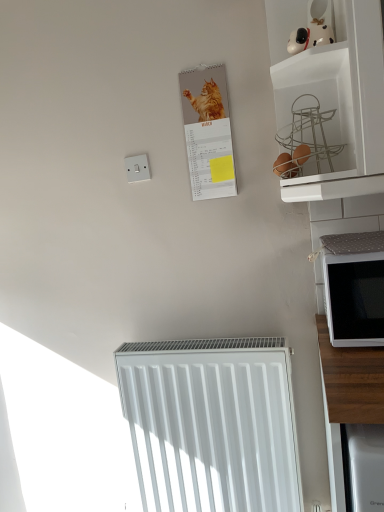
Question: Can you confirm if white matte microwave at right is shorter than white matte wire basket at upper right?

Choices:
 (A) no
 (B) yes

Answer: (B)

Question: Considering the relative sizes of white matte microwave at right and white matte wire basket at upper right in the image provided, is white matte microwave at right bigger than white matte wire basket at upper right?

Choices:
 (A) no
 (B) yes

Answer: (A)

Question: From a real-world perspective, does white matte microwave at right stand above white matte wire basket at upper right?

Choices:
 (A) yes
 (B) no

Answer: (B)

Question: Is white matte microwave at right in contact with white matte wire basket at upper right?

Choices:
 (A) no
 (B) yes

Answer: (A)

Question: Is white matte microwave at right to the left of white matte wire basket at upper right from the viewer's perspective?

Choices:
 (A) no
 (B) yes

Answer: (A)

Question: From the image's perspective, is white matte microwave at right above white matte wire basket at upper right?

Choices:
 (A) yes
 (B) no

Answer: (B)

Question: Does matte paper calendar at upper center have a greater height compared to white plastic switch at upper left?

Choices:
 (A) yes
 (B) no

Answer: (A)

Question: Does matte paper calendar at upper center turn towards white plastic switch at upper left?

Choices:
 (A) no
 (B) yes

Answer: (A)

Question: Can you confirm if matte paper calendar at upper center is thinner than white plastic switch at upper left?

Choices:
 (A) yes
 (B) no

Answer: (B)

Question: From a real-world perspective, is matte paper calendar at upper center over white plastic switch at upper left?

Choices:
 (A) no
 (B) yes

Answer: (B)

Question: Would you consider matte paper calendar at upper center to be distant from white plastic switch at upper left?

Choices:
 (A) no
 (B) yes

Answer: (A)

Question: Does matte paper calendar at upper center have a larger size compared to white plastic switch at upper left?

Choices:
 (A) no
 (B) yes

Answer: (B)

Question: Does white plastic switch at upper left have a lesser width compared to white matte microwave at right?

Choices:
 (A) yes
 (B) no

Answer: (A)